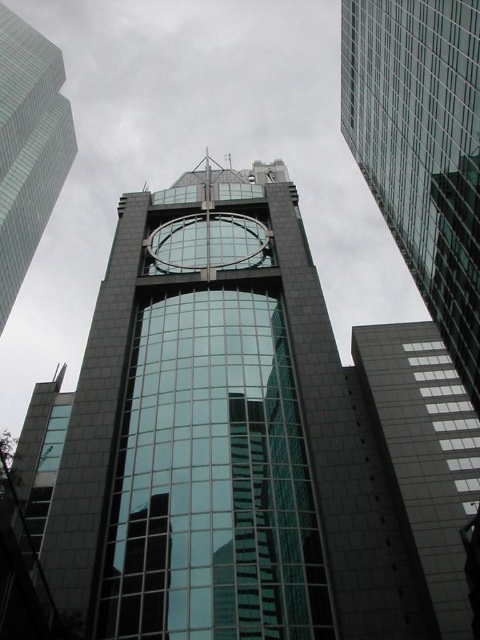
Between transparent glass clock tower at center and transparent glass clock tower at upper center, which one is positioned higher?

transparent glass clock tower at upper center is above.

What do you see at coordinates (421, 148) in the screenshot? Image resolution: width=480 pixels, height=640 pixels. I see `transparent glass clock tower at center` at bounding box center [421, 148].

The height and width of the screenshot is (640, 480). In order to click on transparent glass clock tower at center in this screenshot , I will do `click(421, 148)`.

Who is taller, transparent glass clock tower at center or transparent glass clock at center?

With more height is transparent glass clock tower at center.

Which is more to the left, transparent glass clock tower at center or transparent glass clock at center?

transparent glass clock at center is more to the left.

Is point (436, 168) farther from camera compared to point (207, 218)?

That is False.

The width and height of the screenshot is (480, 640). What are the coordinates of `transparent glass clock tower at center` in the screenshot? It's located at [x=421, y=148].

Is transparent glass clock tower at upper center taller than transparent glass clock at center?

Indeed, transparent glass clock tower at upper center has a greater height compared to transparent glass clock at center.

Can you confirm if transparent glass clock tower at upper center is shorter than transparent glass clock at center?

In fact, transparent glass clock tower at upper center may be taller than transparent glass clock at center.

Is point (51, 198) positioned in front of point (227, 243)?

No.

In order to click on transparent glass clock tower at upper center in this screenshot , I will do `click(28, 147)`.